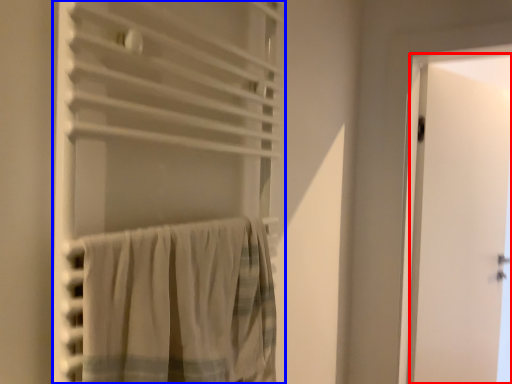
Question: Which point is closer to the camera, door (highlighted by a red box) or curtain (highlighted by a blue box)?

Choices:
 (A) door
 (B) curtain

Answer: (B)